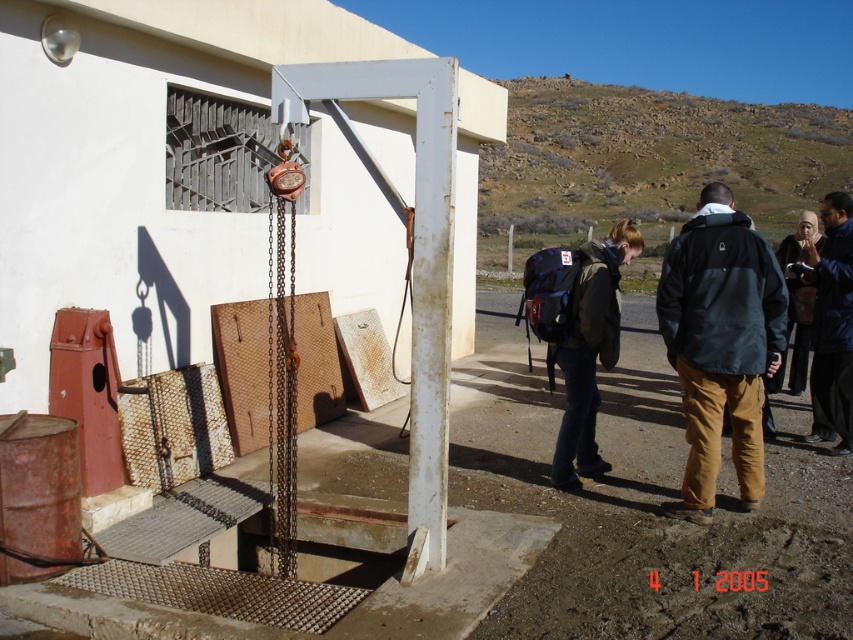
Can you confirm if matte green backpack at center is positioned to the left of dark blue jacket at right?

Correct, you'll find matte green backpack at center to the left of dark blue jacket at right.

Between point (624, 236) and point (844, 358), which one is positioned behind?

Point (844, 358)

What are the coordinates of `matte green backpack at center` in the screenshot? It's located at (590, 349).

Which is in front, point (753, 252) or point (575, 372)?

Point (753, 252)

Identify the location of black fabric jacket at right. (720, 342).

This screenshot has height=640, width=853. I want to click on black fabric jacket at right, so click(720, 342).

From the picture: Does black fabric jacket at right have a greater height compared to dark blue jacket at right?

Incorrect, black fabric jacket at right's height is not larger of dark blue jacket at right's.

Which of these two, black fabric jacket at right or dark blue jacket at right, stands taller?

dark blue jacket at right is taller.

Between point (756, 445) and point (851, 320), which one is positioned in front?

Point (756, 445) is more forward.

At what (x,y) coordinates should I click in order to perform the action: click on black fabric jacket at right. Please return your answer as a coordinate pair (x, y). Looking at the image, I should click on click(720, 342).